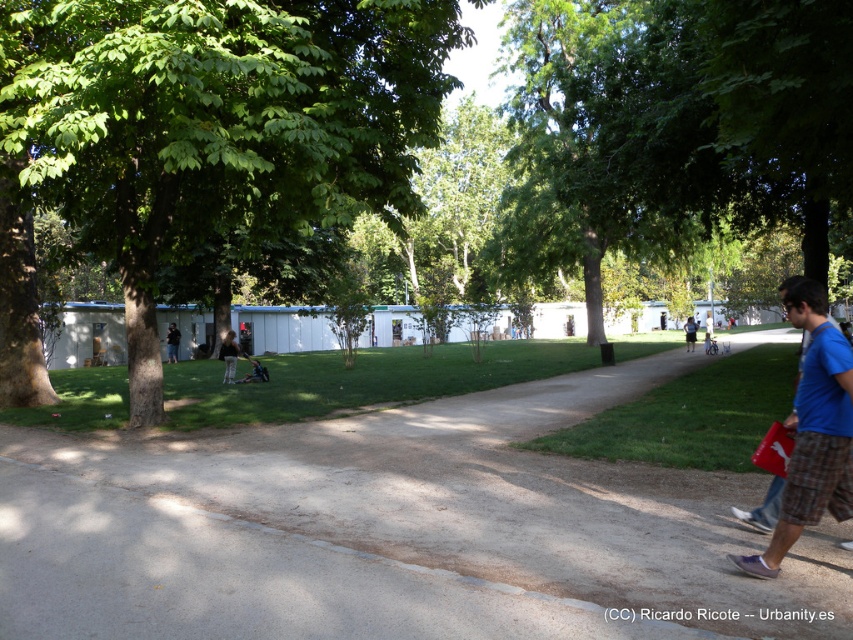
Question: In this image, where is light brown leather jacket at center located relative to dark blue jeans at lower left?

Choices:
 (A) left
 (B) right

Answer: (B)

Question: Which point is farther to the camera?

Choices:
 (A) click(x=218, y=356)
 (B) click(x=167, y=332)
 (C) click(x=689, y=506)

Answer: (A)

Question: From the image, what is the correct spatial relationship of gray concrete pavement at center in relation to dark blue jeans at lower left?

Choices:
 (A) left
 (B) right

Answer: (B)

Question: Which object appears closest to the camera in this image?

Choices:
 (A) gray concrete pavement at center
 (B) green leafy tree at center

Answer: (A)

Question: Based on their relative distances, which object is farther from the dark blue jeans at lower left?

Choices:
 (A) blue plaid shorts at right
 (B) light brown leather jacket at center

Answer: (A)

Question: Does green leafy tree at center have a smaller size compared to blue plaid shorts at right?

Choices:
 (A) no
 (B) yes

Answer: (A)